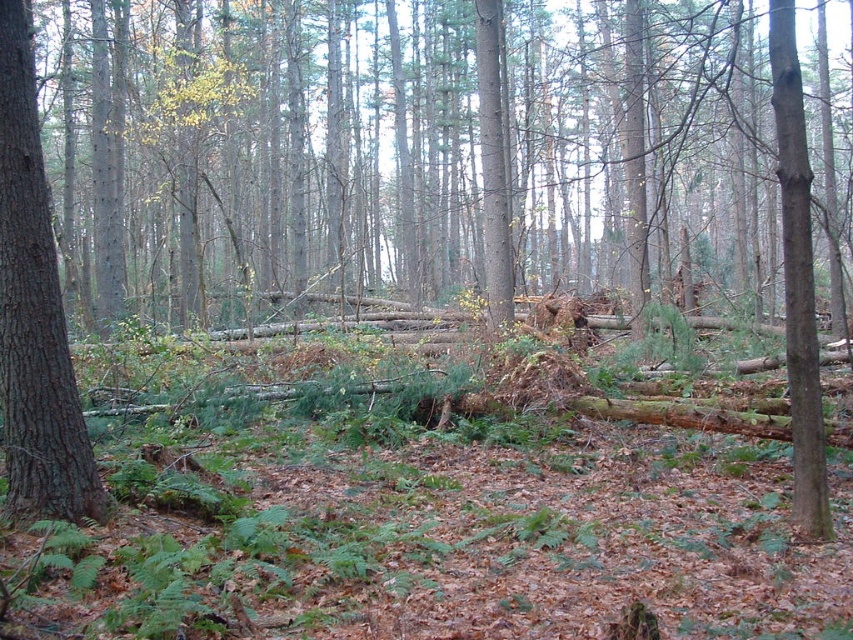
In the scene shown: Who is more forward, [9,26] or [798,328]?

Point [9,26] is in front.

Is point (13, 38) closer to viewer compared to point (795, 452)?

Yes, point (13, 38) is in front of point (795, 452).

The image size is (853, 640). I want to click on smooth brown tree trunk at left, so click(x=33, y=314).